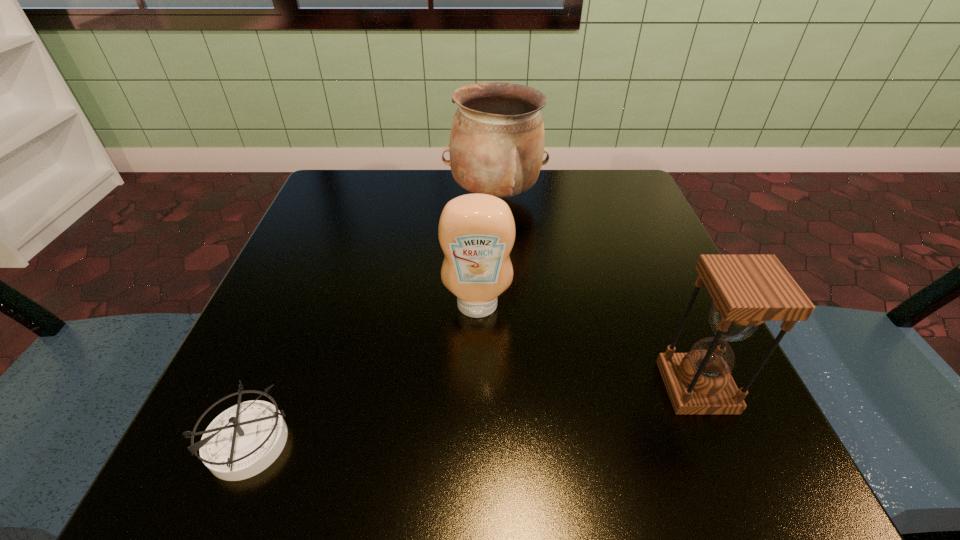
Image resolution: width=960 pixels, height=540 pixels. In order to click on free point between the compass and the urn in this screenshot , I will do `click(372, 319)`.

Where is `vacant space that's between the rightmost object and the leftmost object`? vacant space that's between the rightmost object and the leftmost object is located at coordinates (472, 414).

Where is `blank region between the farthest object and the compass`? This screenshot has width=960, height=540. blank region between the farthest object and the compass is located at coordinates (372, 319).

Image resolution: width=960 pixels, height=540 pixels. In order to click on empty location between the rightmost object and the urn in this screenshot , I will do `click(596, 292)`.

Locate an element on the screen. The width and height of the screenshot is (960, 540). free space between the shortest object and the rightmost object is located at coordinates (472, 414).

The height and width of the screenshot is (540, 960). I want to click on free point between the condiment and the hourglass, so 587,347.

At what (x,y) coordinates should I click in order to perform the action: click on vacant area between the urn and the hourglass. Please return your answer as a coordinate pair (x, y). The height and width of the screenshot is (540, 960). Looking at the image, I should click on (596, 292).

You are a GUI agent. You are given a task and a screenshot of the screen. Output one action in this format:
    pyautogui.click(x=<x>, y=<y>)
    Task: Click on the object that can be found as the closest to the rightmost object
    
    Given the screenshot: What is the action you would take?
    pyautogui.click(x=476, y=232)

You are a GUI agent. You are given a task and a screenshot of the screen. Output one action in this format:
    pyautogui.click(x=<x>, y=<y>)
    Task: Click on the object that is the second closest one to the hourglass
    The height and width of the screenshot is (540, 960).
    Given the screenshot: What is the action you would take?
    pyautogui.click(x=497, y=138)

Where is `vacant space that satisfies the following two spatial constraints: 1. on the label of the hourglass; 2. on the left side of the condiment`? The height and width of the screenshot is (540, 960). vacant space that satisfies the following two spatial constraints: 1. on the label of the hourglass; 2. on the left side of the condiment is located at coordinates (477, 387).